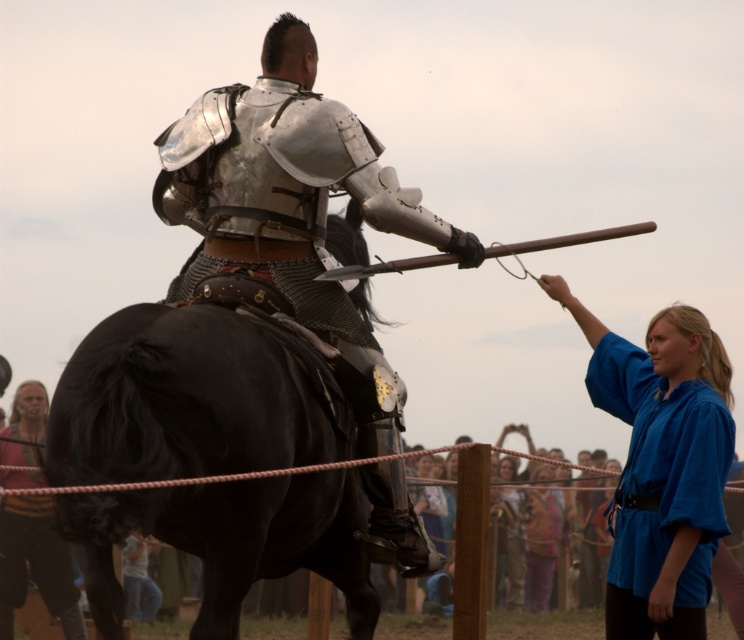
In order to click on blue cotton shirt at upper right in this screenshot , I will do `click(660, 467)`.

Can you confirm if blue cotton shirt at upper right is shorter than multicolored fabric at lower center?

Incorrect, blue cotton shirt at upper right's height does not fall short of multicolored fabric at lower center's.

You are a GUI agent. You are given a task and a screenshot of the screen. Output one action in this format:
    pyautogui.click(x=<x>, y=<y>)
    Task: Click on the blue cotton shirt at upper right
    The image size is (744, 640).
    Given the screenshot: What is the action you would take?
    pyautogui.click(x=660, y=467)

Can you confirm if shiny metallic armor at center is positioned above multicolored fabric at lower center?

Correct, shiny metallic armor at center is located above multicolored fabric at lower center.

Is shiny metallic armor at center bigger than multicolored fabric at lower center?

Yes, shiny metallic armor at center is bigger than multicolored fabric at lower center.

I want to click on shiny metallic armor at center, so click(295, 211).

Describe the element at coordinates (660, 467) in the screenshot. I see `blue cotton shirt at upper right` at that location.

Which of these two, blue cotton shirt at upper right or blue cotton shirt at center, stands shorter?

Standing shorter between the two is blue cotton shirt at center.

Locate an element on the screen. blue cotton shirt at upper right is located at coordinates (660, 467).

This screenshot has width=744, height=640. What are the coordinates of `blue cotton shirt at upper right` in the screenshot? It's located at (660, 467).